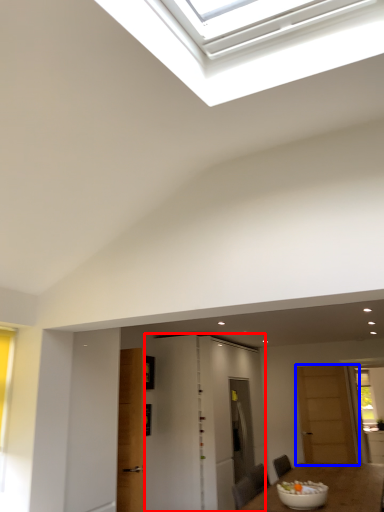
Question: Which object appears closest to the camera in this image, door (highlighted by a red box) or door (highlighted by a blue box)?

Choices:
 (A) door
 (B) door

Answer: (A)